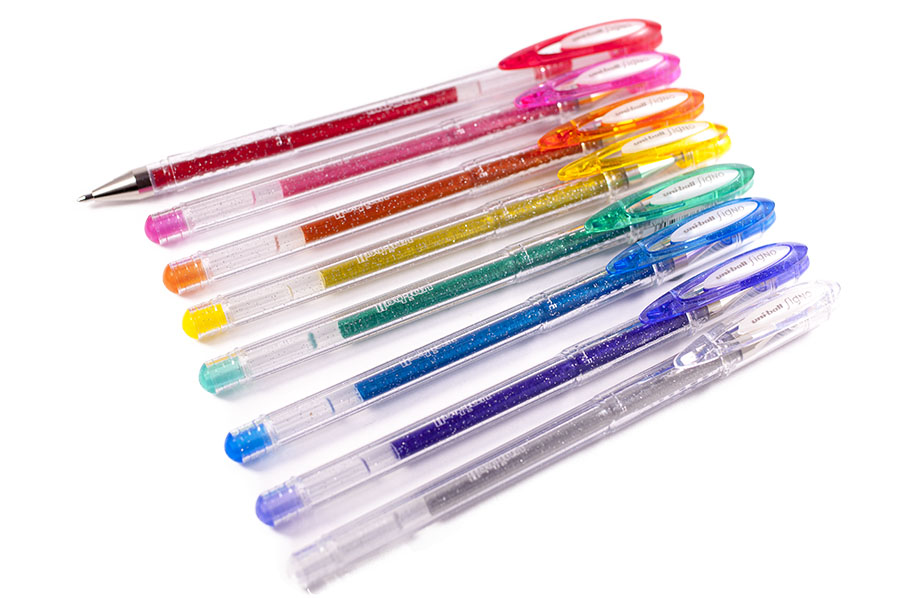
Locate an element on the screen. This screenshot has height=598, width=900. pen caps is located at coordinates (778, 327), (727, 271), (718, 225), (694, 188), (661, 150), (626, 112), (600, 77), (582, 41).